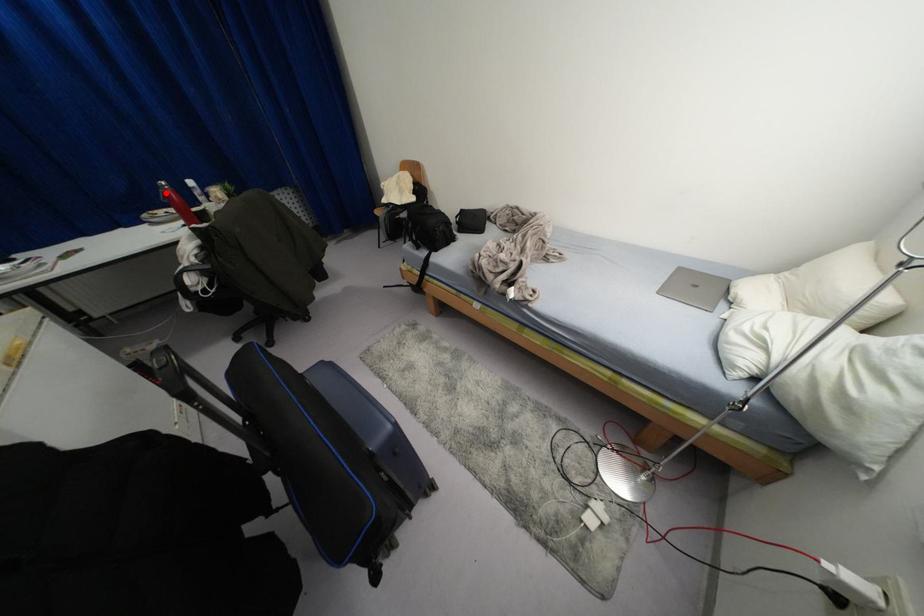
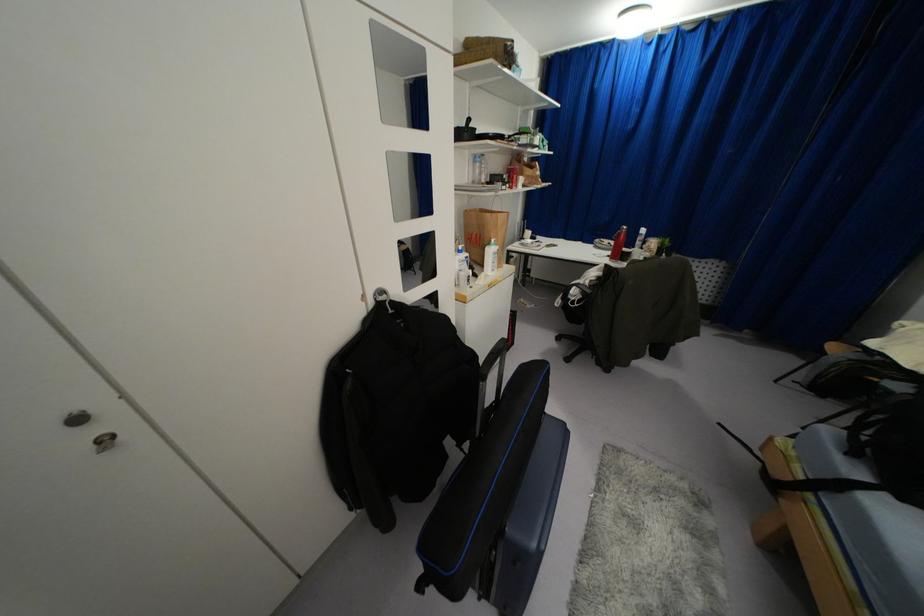
Question: I am providing you with two images of the same scene from different viewpoints. Given a red point in image1, look at the same physical point in image2. Is it:

Choices:
 (A) Closer to the viewpoint
 (B) Farther from the viewpoint

Answer: (A)